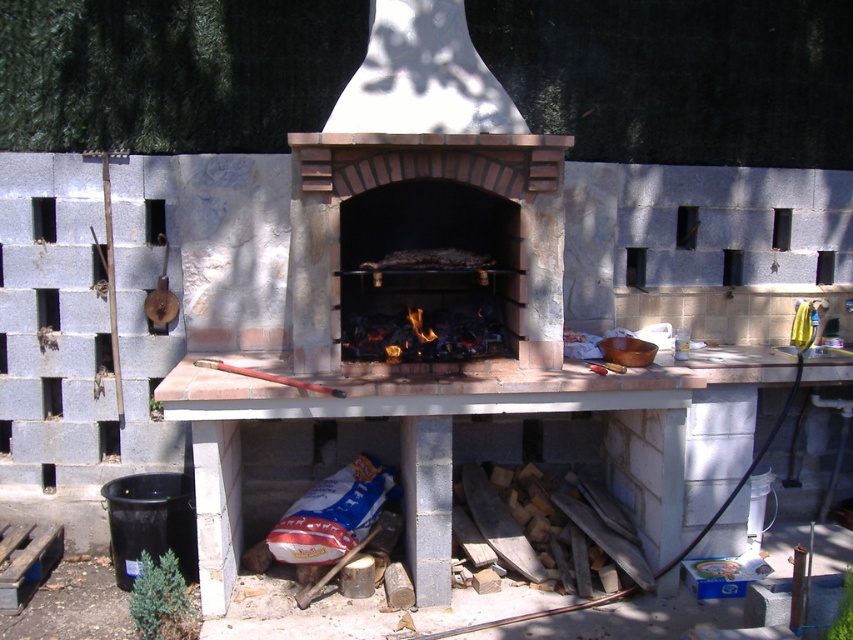
Can you confirm if brick oven at center is bigger than charcoal briquettes at center?

Yes, brick oven at center is bigger than charcoal briquettes at center.

Consider the image. Between brick oven at center and charcoal briquettes at center, which one appears on the right side from the viewer's perspective?

brick oven at center is more to the right.

Locate an element on the screen. brick oven at center is located at coordinates (426, 250).

Where is `brick oven at center`? The image size is (853, 640). brick oven at center is located at coordinates (426, 250).